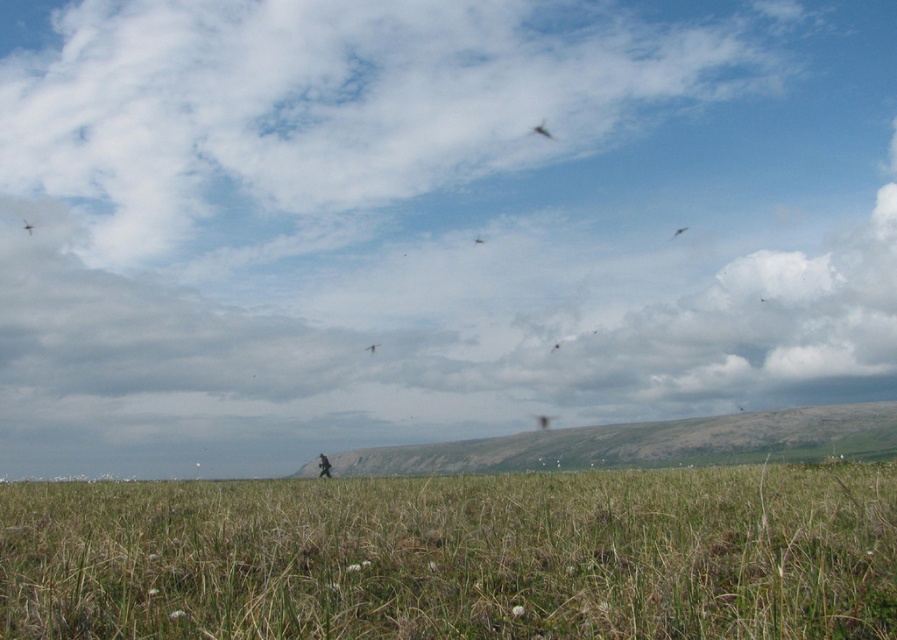
Question: Which object is farther from the camera taking this photo?

Choices:
 (A) green grass at lower center
 (B) smooth feathered bird at upper center

Answer: (B)

Question: Based on their relative distances, which object is farther from the green grass at lower center?

Choices:
 (A) smooth feathered bird at center
 (B) smooth feathered bird at upper center

Answer: (A)

Question: Which point appears closest to the camera in this image?

Choices:
 (A) (321, 454)
 (B) (534, 131)
 (C) (682, 230)

Answer: (A)

Question: From the image, what is the correct spatial relationship of gray rocky hill at center in relation to smooth feathered bird at center?

Choices:
 (A) above
 (B) below

Answer: (B)

Question: Is the position of brown feathered bird at center less distant than that of smooth feathered bird at upper center?

Choices:
 (A) no
 (B) yes

Answer: (B)

Question: Can you confirm if green grassy field at center is bigger than brown feathered bird at center?

Choices:
 (A) no
 (B) yes

Answer: (B)